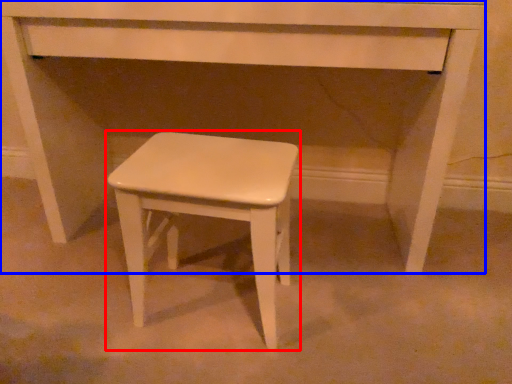
Question: Which object appears farthest to the camera in this image, stool (highlighted by a red box) or table (highlighted by a blue box)?

Choices:
 (A) stool
 (B) table

Answer: (B)